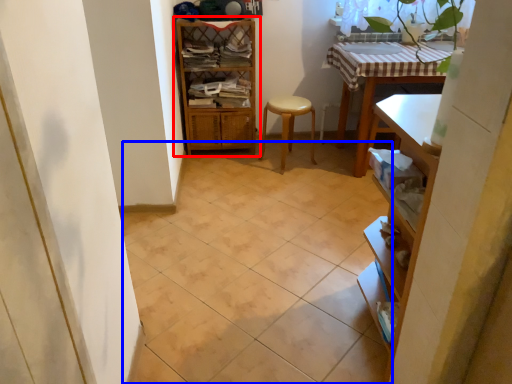
Question: Which object appears farthest to the camera in this image, shelf (highlighted by a red box) or ceramic tile (highlighted by a blue box)?

Choices:
 (A) shelf
 (B) ceramic tile

Answer: (A)